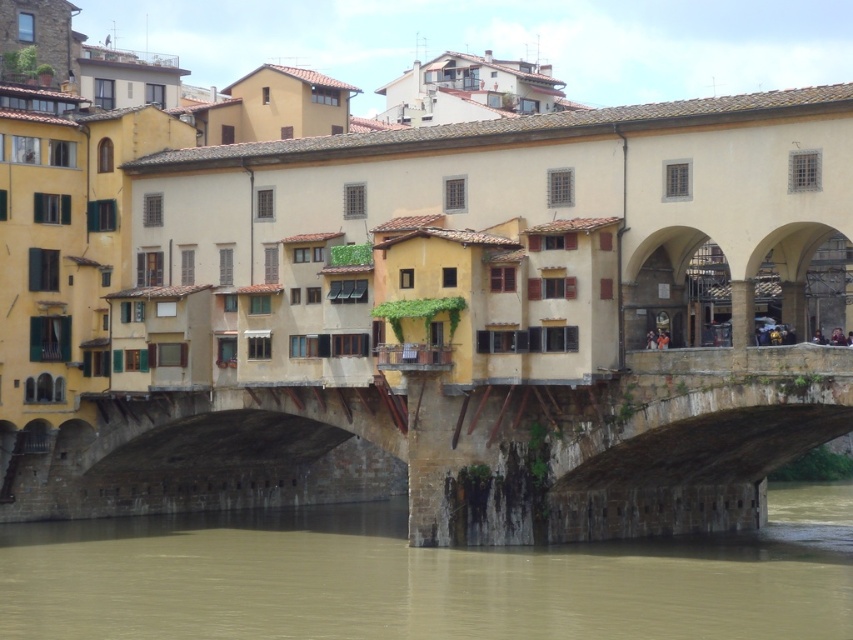
Question: Can you confirm if stone bridge at center is wider than brown muddy water at lower center?

Choices:
 (A) no
 (B) yes

Answer: (A)

Question: Which object appears closest to the camera in this image?

Choices:
 (A) stone bridge at center
 (B) brown muddy water at lower center

Answer: (B)

Question: Which of the following is the closest to the observer?

Choices:
 (A) brown muddy water at lower center
 (B) stone bridge at center

Answer: (A)

Question: Is stone bridge at center wider than brown muddy water at lower center?

Choices:
 (A) no
 (B) yes

Answer: (A)

Question: Can you confirm if stone bridge at center is positioned above brown muddy water at lower center?

Choices:
 (A) yes
 (B) no

Answer: (A)

Question: Among these points, which one is farthest from the camera?

Choices:
 (A) (181, 429)
 (B) (170, 570)

Answer: (A)